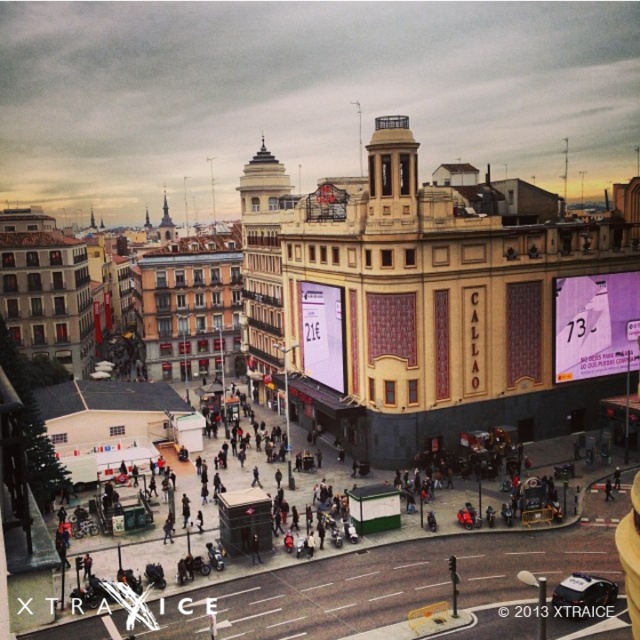
Question: Which of the following is the closest to the observer?

Choices:
 (A) (237, 189)
 (B) (566, 324)

Answer: (B)

Question: Considering the real-world distances, which object is farthest from the matte purple billboard at center?

Choices:
 (A) white glossy sign at center
 (B) white textured building at center

Answer: (B)

Question: Can you confirm if white textured building at center is smaller than matte purple billboard at center?

Choices:
 (A) yes
 (B) no

Answer: (B)

Question: Can you confirm if matte purple billboard at center is thinner than white glossy sign at center?

Choices:
 (A) no
 (B) yes

Answer: (A)

Question: Does white textured building at center have a smaller size compared to matte purple billboard at center?

Choices:
 (A) no
 (B) yes

Answer: (A)

Question: Which object is the closest to the matte purple billboard at center?

Choices:
 (A) white glossy sign at center
 (B) white textured building at center

Answer: (A)